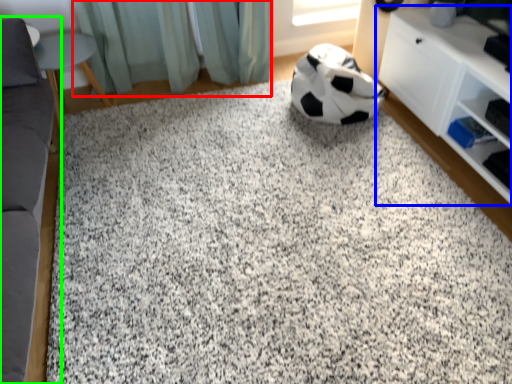
Question: Considering the real-world distances, which object is closest to curtain (highlighted by a red box)? shelf (highlighted by a blue box) or furniture (highlighted by a green box).

Choices:
 (A) shelf
 (B) furniture

Answer: (B)